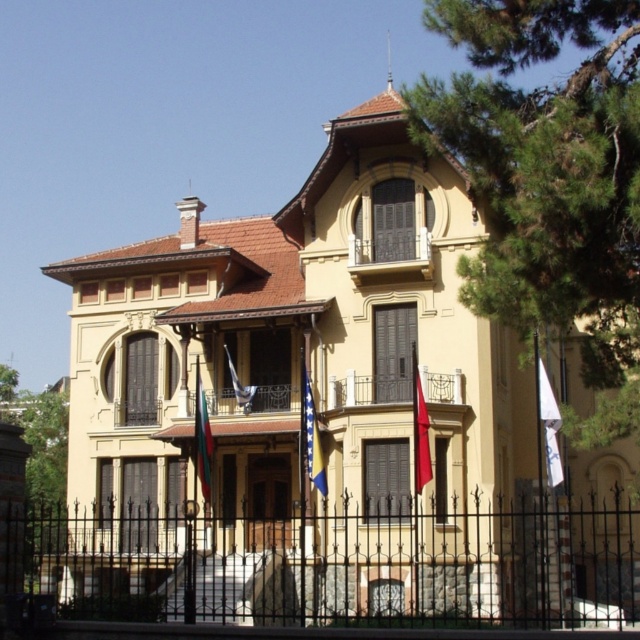
Between green leafy tree at right and silky white flag at center, which one has more height?

green leafy tree at right

Who is more distant from viewer, (x=612, y=291) or (x=248, y=388)?

Point (x=248, y=388)

Locate an element on the screen. This screenshot has width=640, height=640. green leafy tree at right is located at coordinates (548, 180).

Who is higher up, black wrought iron fence at center or green leafy tree at right?

green leafy tree at right

The height and width of the screenshot is (640, 640). Find the location of `black wrought iron fence at center`. black wrought iron fence at center is located at coordinates (337, 564).

What do you see at coordinates (337, 564) in the screenshot?
I see `black wrought iron fence at center` at bounding box center [337, 564].

The width and height of the screenshot is (640, 640). Find the location of `black wrought iron fence at center`. black wrought iron fence at center is located at coordinates (337, 564).

Can you confirm if black wrought iron fence at center is wider than metallic balcony at center?

Yes.

Is black wrought iron fence at center below metallic balcony at center?

Correct, black wrought iron fence at center is located below metallic balcony at center.

This screenshot has height=640, width=640. In order to click on black wrought iron fence at center in this screenshot , I will do `click(337, 564)`.